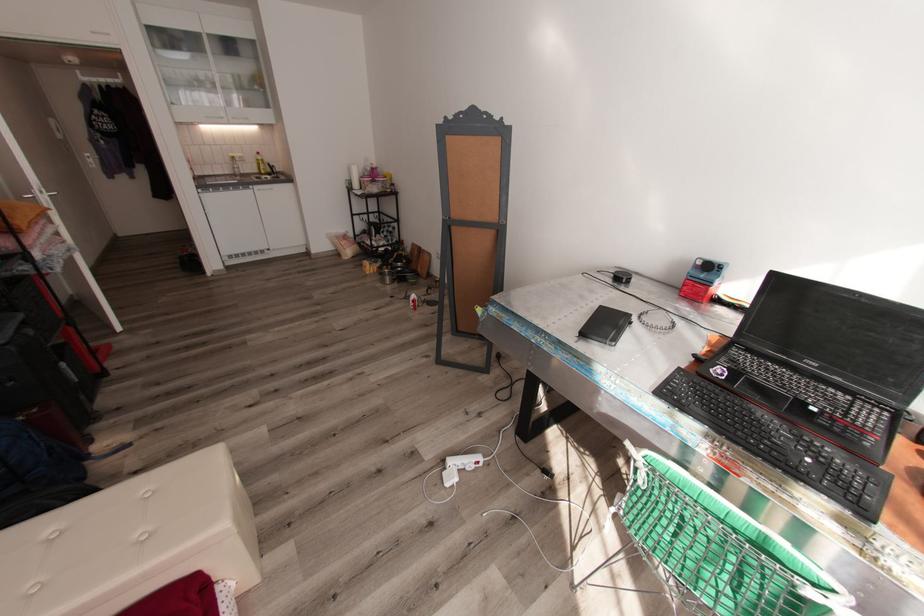
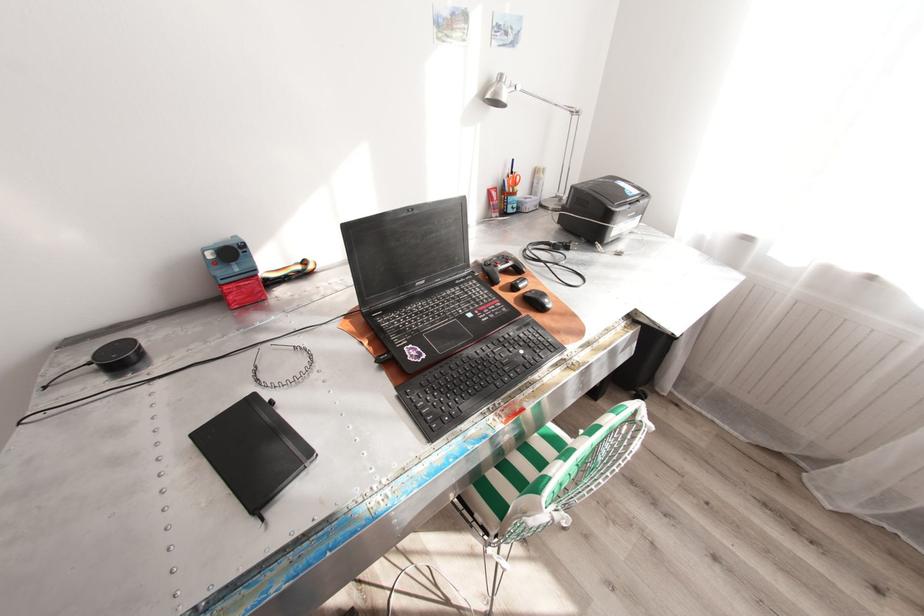
Where in the second image is the point corresponding to (618,341) from the first image?

(314, 452)